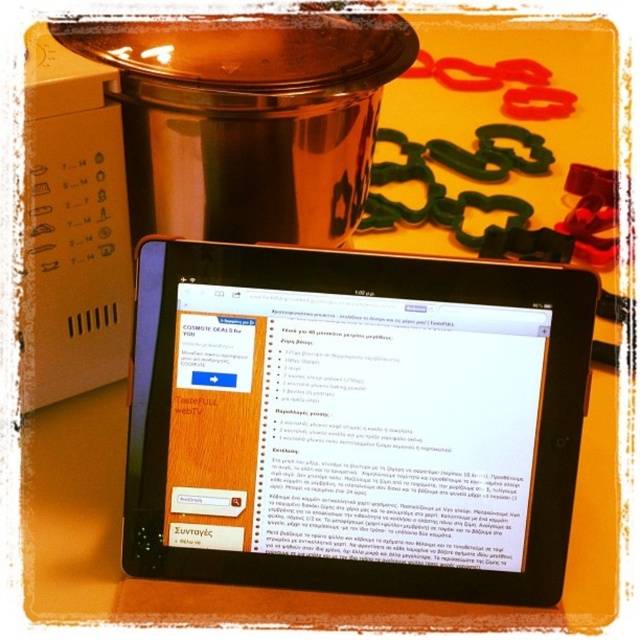
Question: Which point appears farthest from the camera in this image?

Choices:
 (A) (312, 449)
 (B) (52, 268)

Answer: (B)

Question: Does black glossy tablet at center have a smaller size compared to white plastic microwave at left?

Choices:
 (A) no
 (B) yes

Answer: (B)

Question: Does black glossy tablet at center lie in front of white plastic microwave at left?

Choices:
 (A) yes
 (B) no

Answer: (B)

Question: Which point is farther to the camera?

Choices:
 (A) (556, 369)
 (B) (120, 284)

Answer: (B)

Question: Does black glossy tablet at center appear over white plastic microwave at left?

Choices:
 (A) no
 (B) yes

Answer: (A)